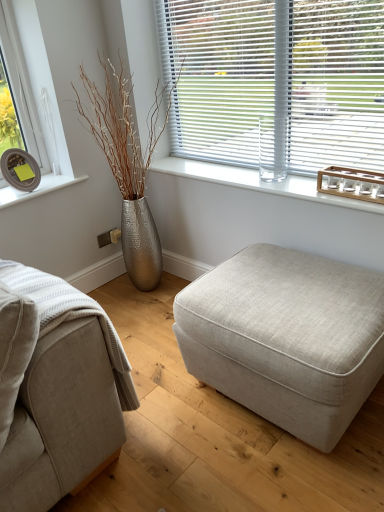
Where is `free space above beige fabric ottoman at center (from a real-world perspective)`? The height and width of the screenshot is (512, 384). free space above beige fabric ottoman at center (from a real-world perspective) is located at coordinates (289, 291).